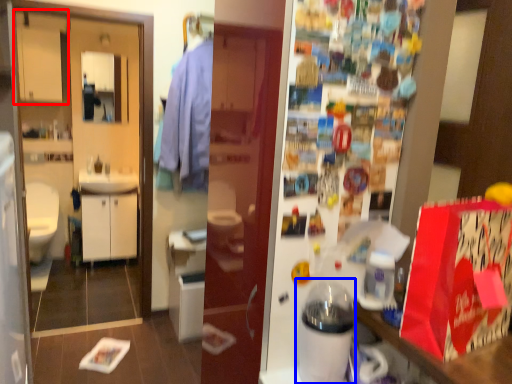
Question: Which object is closer to the camera taking this photo, cabinetry (highlighted by a red box) or appliance (highlighted by a blue box)?

Choices:
 (A) cabinetry
 (B) appliance

Answer: (B)